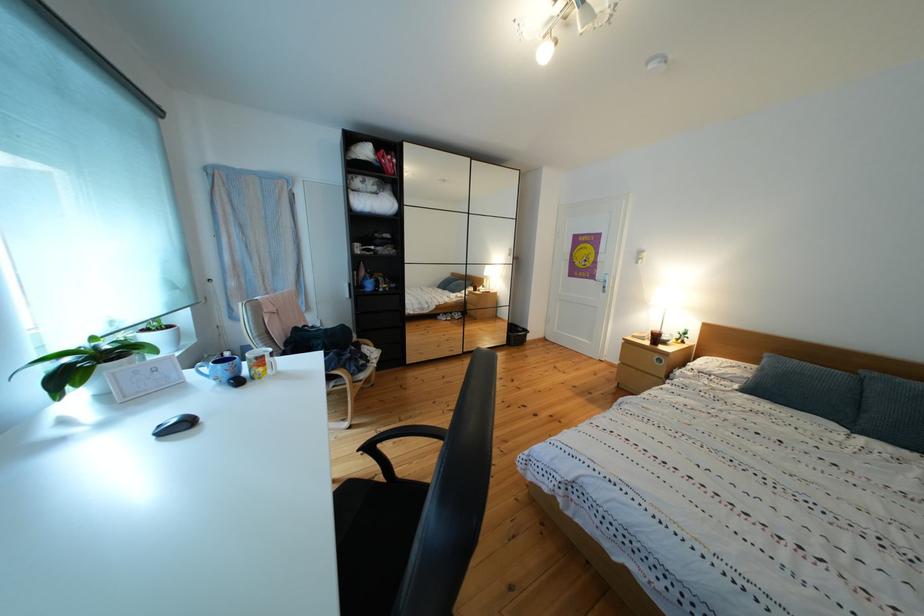
The width and height of the screenshot is (924, 616). What do you see at coordinates (608, 282) in the screenshot?
I see `a silver door handle` at bounding box center [608, 282].